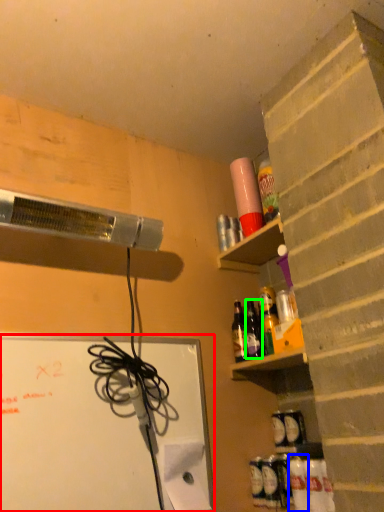
Question: Based on their relative distances, which object is nearer to bulletin board (highlighted by a red box)? Choose from bottle (highlighted by a blue box) and bottle (highlighted by a green box).

Choices:
 (A) bottle
 (B) bottle

Answer: (B)